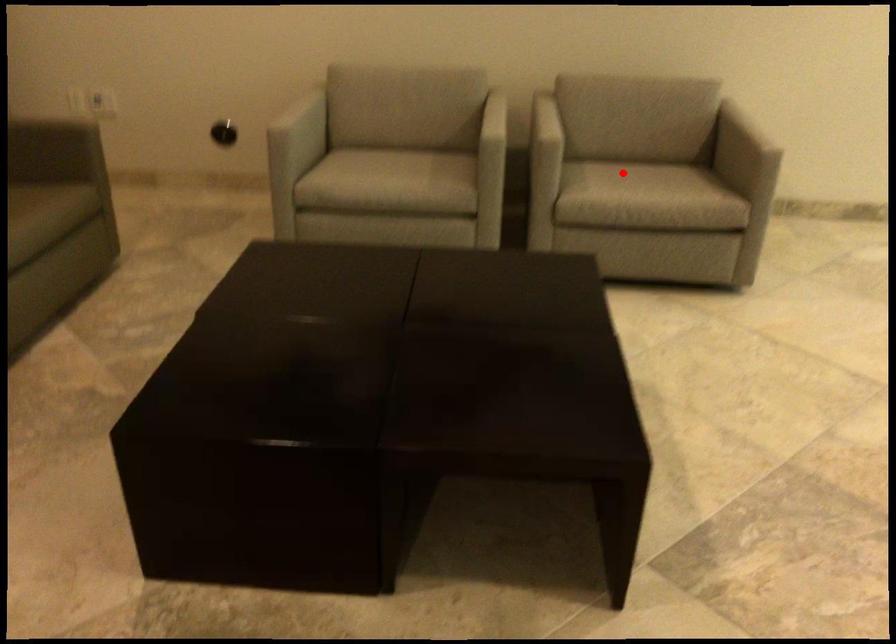
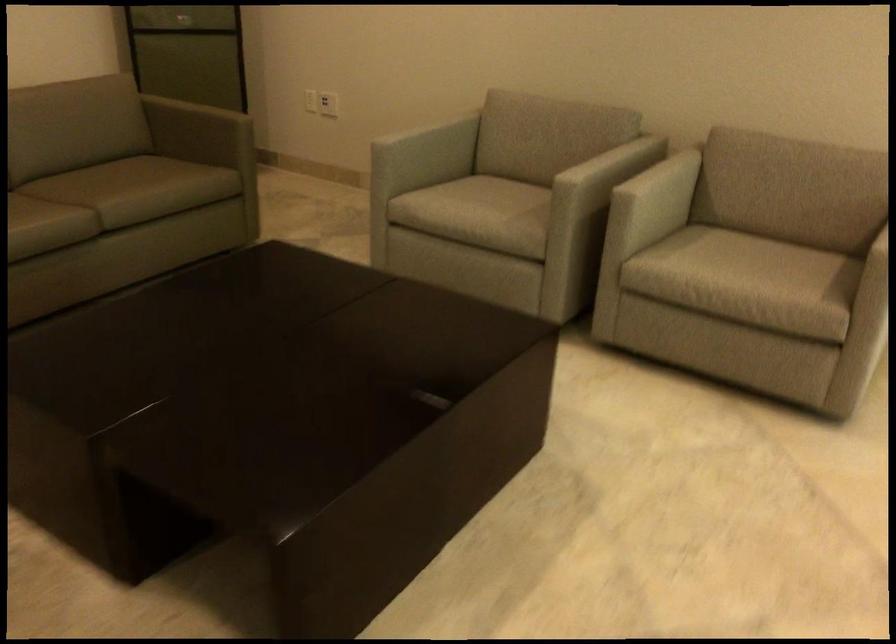
Where in the second image is the point corresponding to the highlighted location from the first image?

(739, 257)